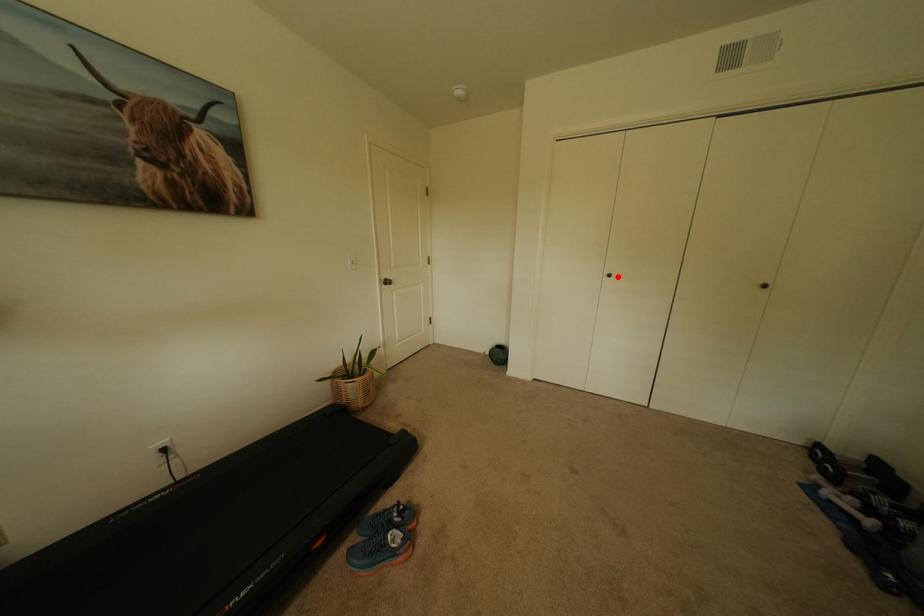
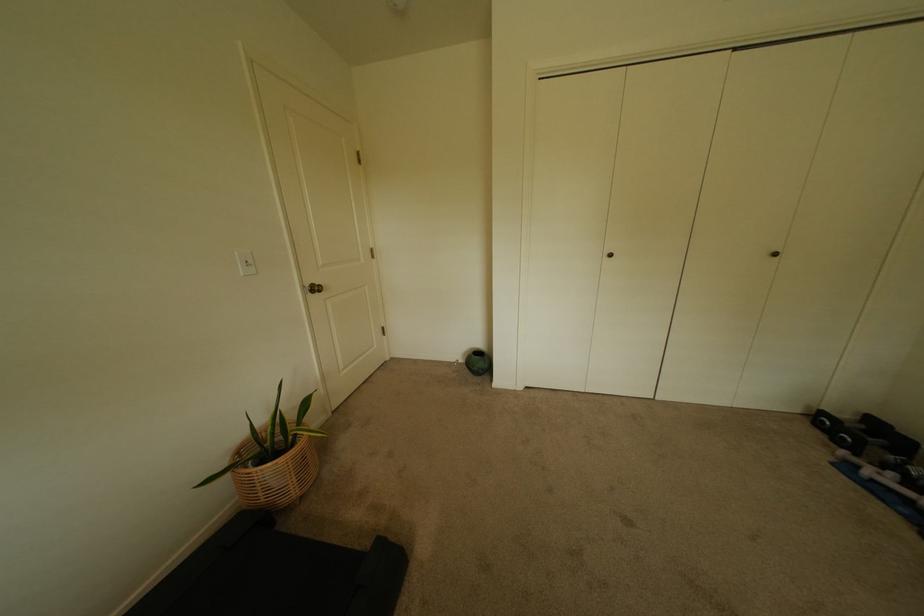
The point at the highlighted location is marked in the first image. Where is the corresponding point in the second image?

(618, 256)